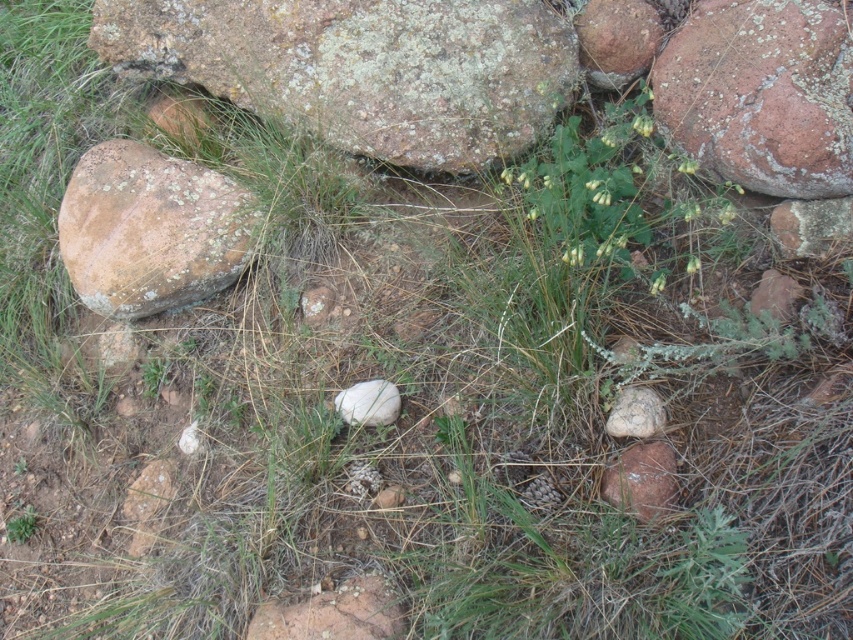
Question: Does lichen-covered rock at upper center have a greater width compared to green matte flower at center?

Choices:
 (A) yes
 (B) no

Answer: (A)

Question: Does lichen-covered rock at left appear on the left side of brown rough rock at center?

Choices:
 (A) yes
 (B) no

Answer: (A)

Question: Does lichen-covered rock at upper center appear under smooth gray rock at center-right?

Choices:
 (A) no
 (B) yes

Answer: (A)

Question: Which point is closer to the camera taking this photo?

Choices:
 (A) (798, 218)
 (B) (86, 282)
 (C) (654, 435)
 (D) (370, 637)

Answer: (D)

Question: Which object appears closest to the camera in this image?

Choices:
 (A) lichen-covered rock at upper center
 (B) speckled brown rock at right
 (C) green matte flower at center

Answer: (B)

Question: Which is nearer to the smooth gray rock at center-right?

Choices:
 (A) brown rough rock at center
 (B) green matte flower at center

Answer: (B)